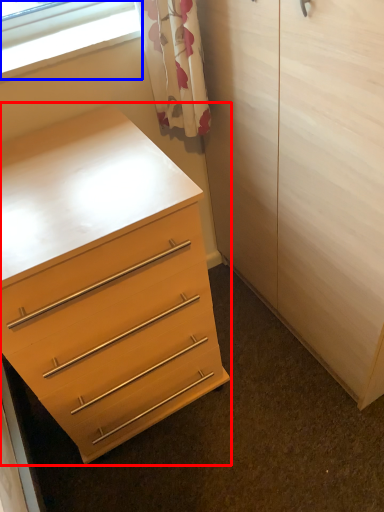
Question: Which object is further to the camera taking this photo, chest of drawers (highlighted by a red box) or window (highlighted by a blue box)?

Choices:
 (A) chest of drawers
 (B) window

Answer: (B)